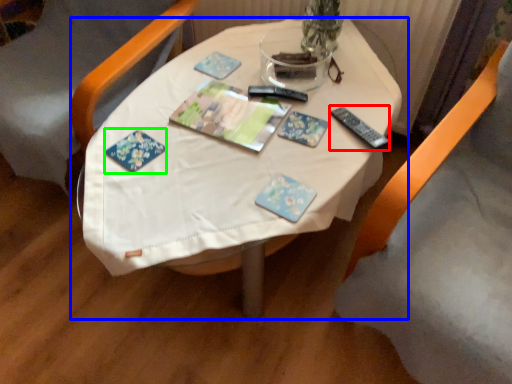
Question: Considering the real-world distances, which object is farthest from remote (highlighted by a red box)? table (highlighted by a blue box) or book (highlighted by a green box)?

Choices:
 (A) table
 (B) book

Answer: (B)